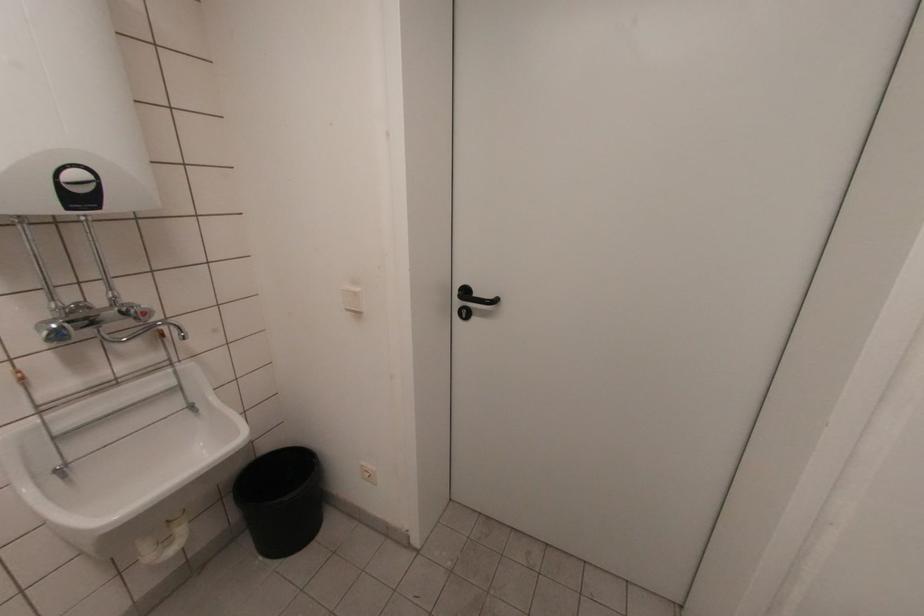
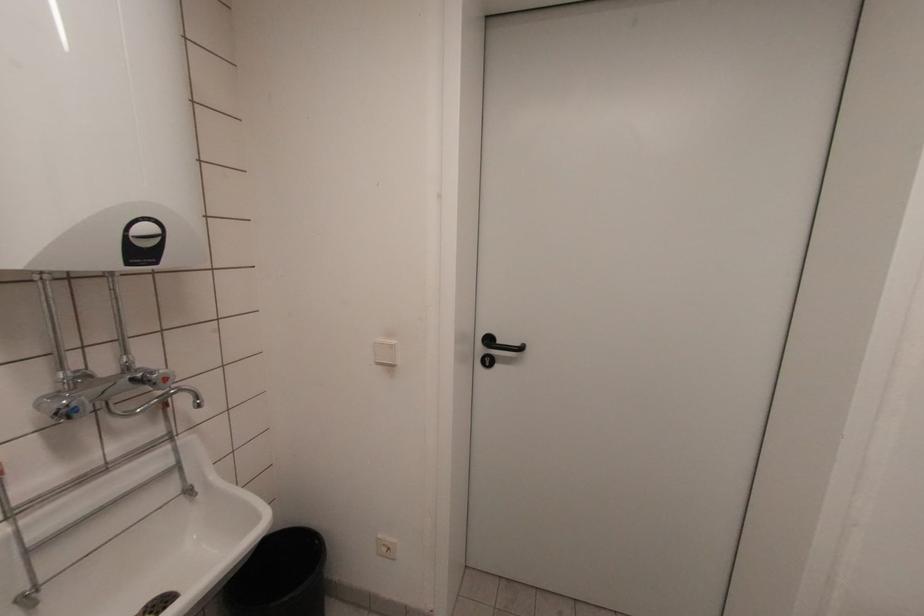
Locate, in the second image, the point that corresponds to point 143,307 in the first image.

(163, 371)